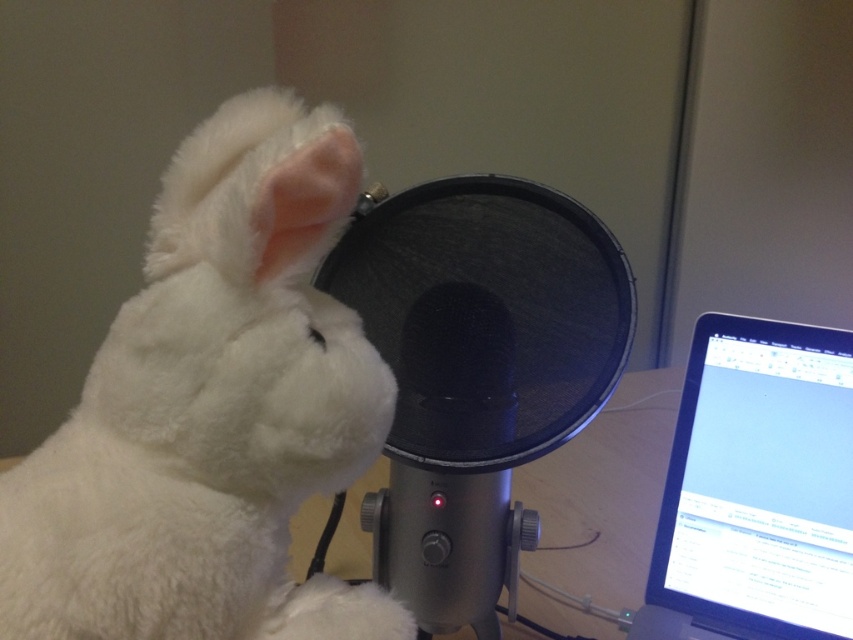
Question: Which point is farther to the camera?

Choices:
 (A) (212, 584)
 (B) (704, 376)

Answer: (B)

Question: Is white plush rabbit at upper left positioned behind metallic black microphone at center?

Choices:
 (A) yes
 (B) no

Answer: (B)

Question: Can you confirm if white plush rabbit at upper left is bigger than silver metallic laptop at right?

Choices:
 (A) yes
 (B) no

Answer: (A)

Question: Which object is positioned farthest from the metallic black microphone at center?

Choices:
 (A) silver metallic laptop at right
 (B) white plush rabbit at upper left

Answer: (A)

Question: Among these points, which one is farthest from the camera?

Choices:
 (A) (70, 513)
 (B) (451, 580)

Answer: (B)

Question: Can you confirm if metallic black microphone at center is positioned to the left of silver metallic laptop at right?

Choices:
 (A) yes
 (B) no

Answer: (A)